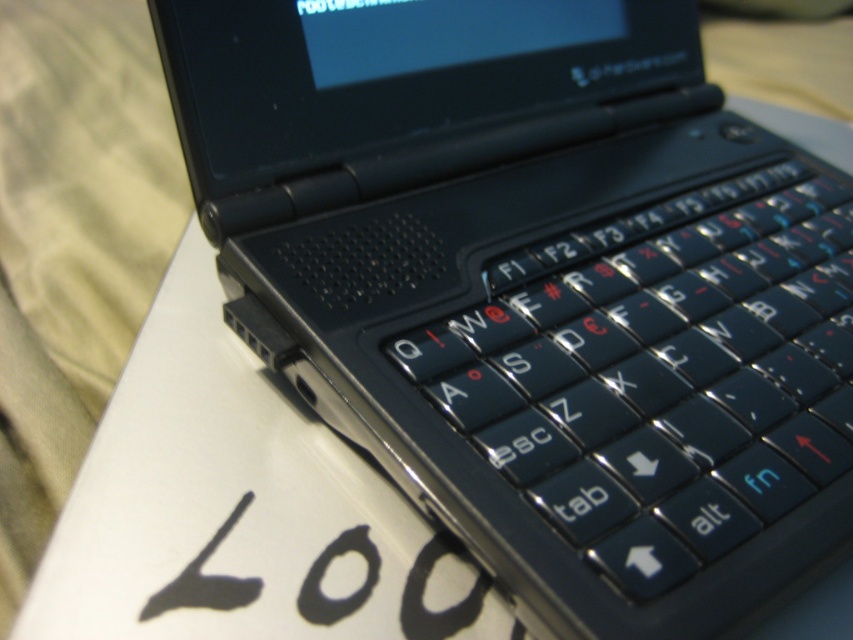
Question: Does black matte keyboard at center appear on the left side of black matte writing at lower left?

Choices:
 (A) yes
 (B) no

Answer: (B)

Question: Among these points, which one is nearest to the camera?

Choices:
 (A) (360, 544)
 (B) (537, 472)

Answer: (B)

Question: Which of the following is the farthest from the observer?

Choices:
 (A) black matte keyboard at center
 (B) black matte writing at lower left

Answer: (B)

Question: Does black matte keyboard at center lie behind black matte writing at lower left?

Choices:
 (A) no
 (B) yes

Answer: (A)

Question: Does black matte keyboard at center have a smaller size compared to black matte writing at lower left?

Choices:
 (A) yes
 (B) no

Answer: (B)